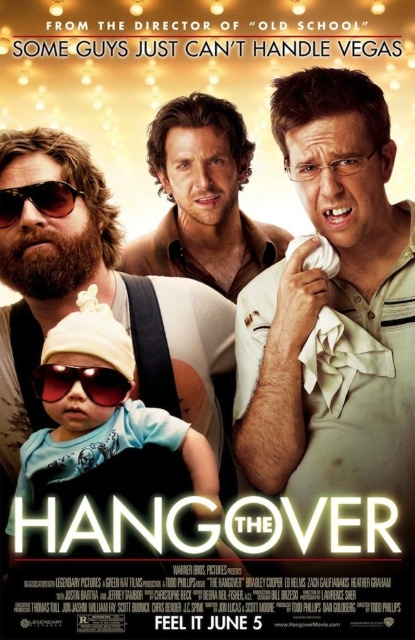
You are standing in front of the movie poster for The Hangover. There are two points on the poster at coordinates point (53, 371) and point (26, 189). Which point is closer to you?

Point (53, 371) is closer to the viewer than point (26, 189).

What is the exact position of the white striped polo shirt at center on the movie poster?

The white striped polo shirt at center is located at point (334, 308).

In the movie poster for The Hangover, there are two men wearing a white striped polo shirt at center and a matte brown shirt at center. Which one is positioned to the right?

The white striped polo shirt at center is positioned to the right of the matte brown shirt at center.